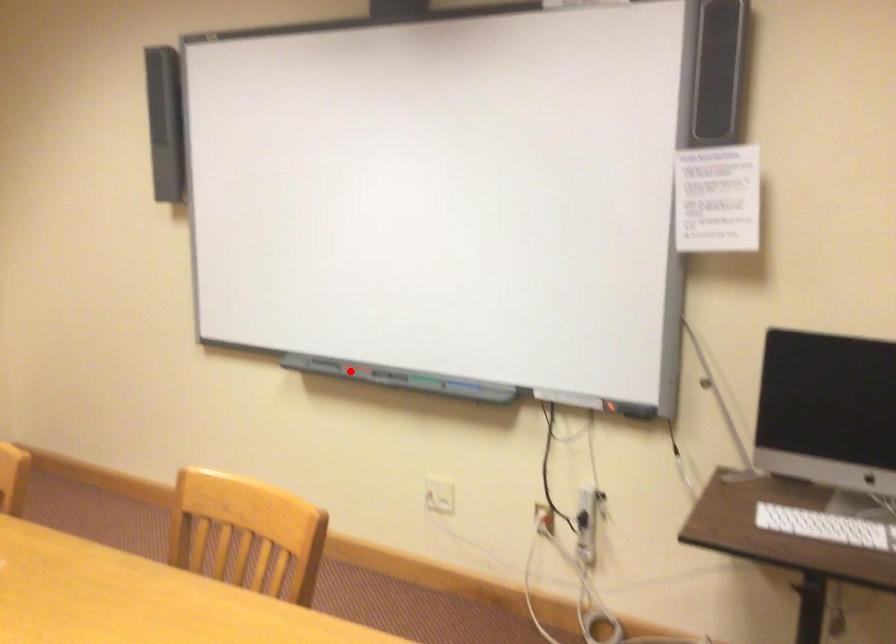
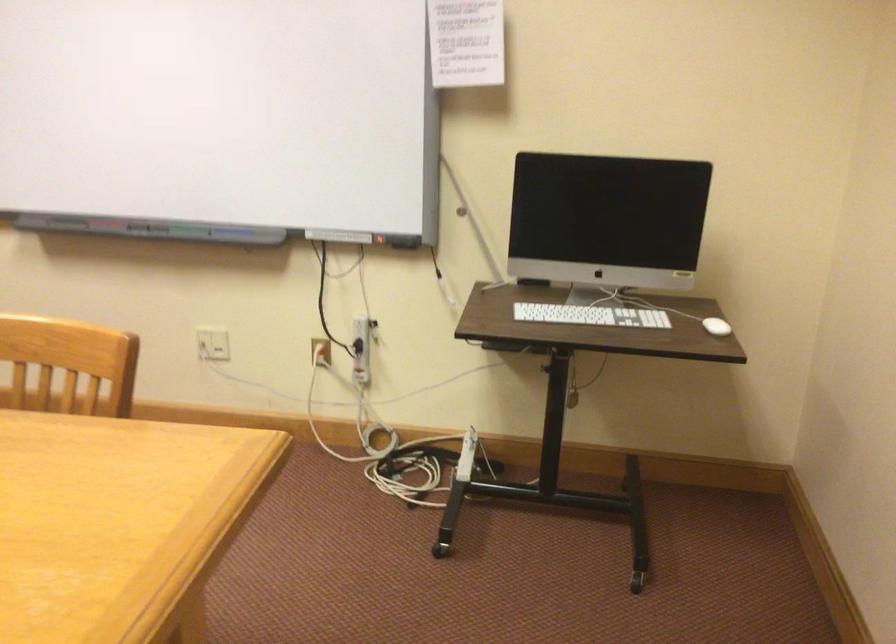
Locate, in the second image, the point that corresponds to the highlighted location in the first image.

(100, 225)